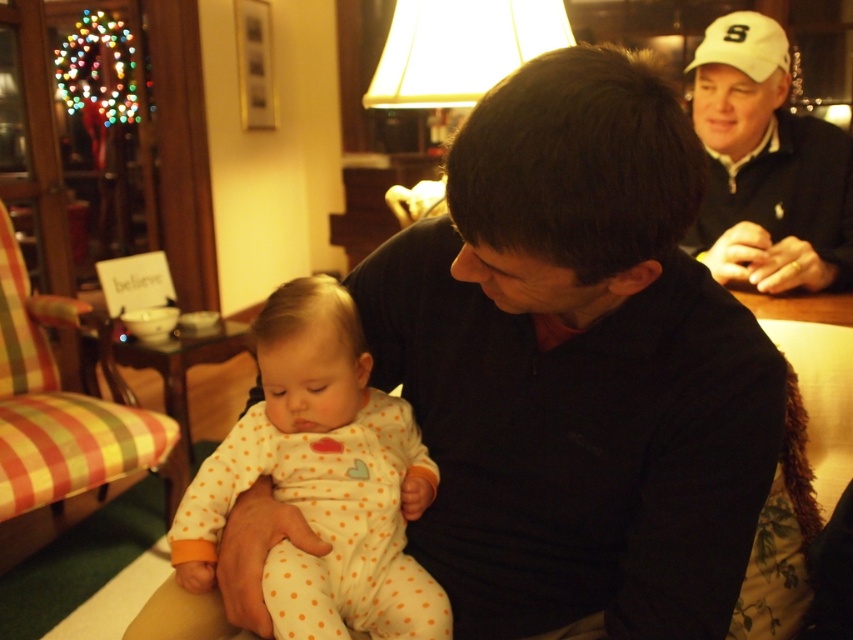
Is point (519, 573) more distant than point (804, 234)?

No.

Is point (387, 243) closer to camera compared to point (784, 163)?

Yes, it is in front of point (784, 163).

Where is `matte black shirt at center`? matte black shirt at center is located at coordinates (576, 365).

Can you confirm if matte black shirt at center is taller than white matte baseball cap at upper right?

Yes.

Who is more forward, (656, 483) or (711, 35)?

Point (656, 483) is in front.

Where is `matte black shirt at center`? matte black shirt at center is located at coordinates (576, 365).

Who is lower down, white polka dot onesie at center or white matte baseball cap at upper right?

Positioned lower is white polka dot onesie at center.

In the scene shown: Who is more forward, (271, 621) or (711, 42)?

Point (271, 621) is more forward.

Does point (277, 378) lie in front of point (775, 65)?

Yes, it is.

You are a GUI agent. You are given a task and a screenshot of the screen. Output one action in this format:
    pyautogui.click(x=<x>, y=<y>)
    Task: Click on the white polka dot onesie at center
    This screenshot has height=640, width=853.
    Given the screenshot: What is the action you would take?
    pyautogui.click(x=322, y=480)